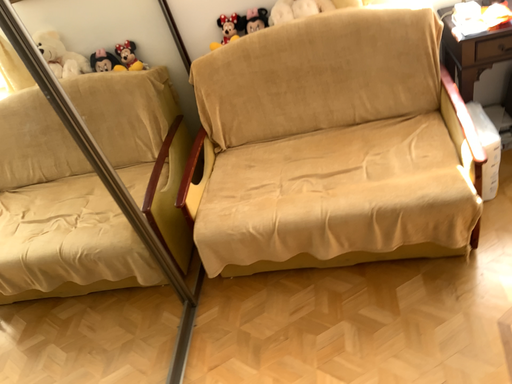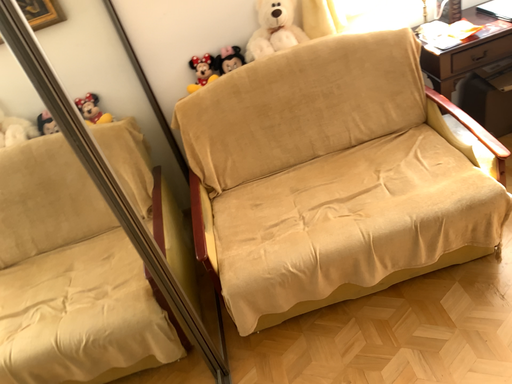
Question: Which way did the camera rotate in the video?

Choices:
 (A) rotated left
 (B) rotated right

Answer: (B)